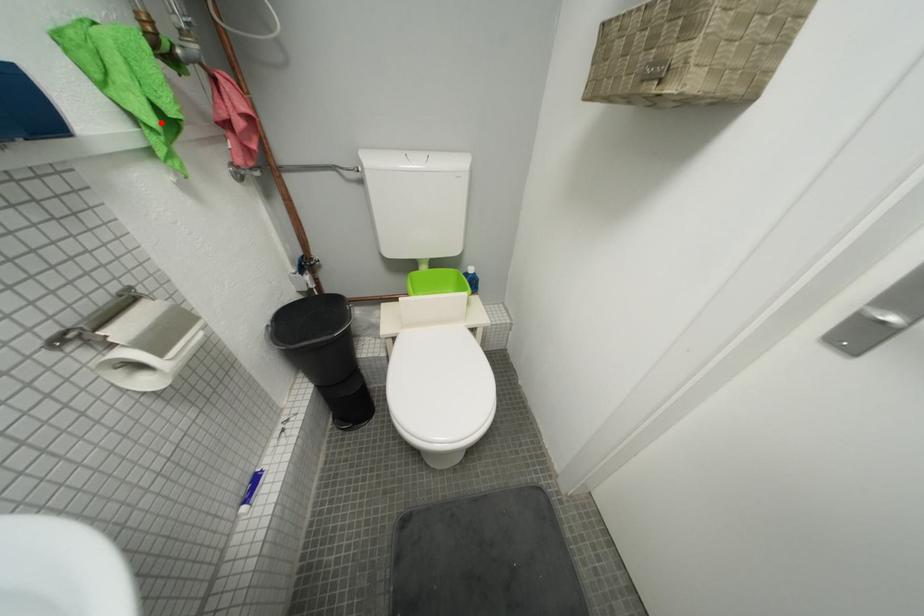
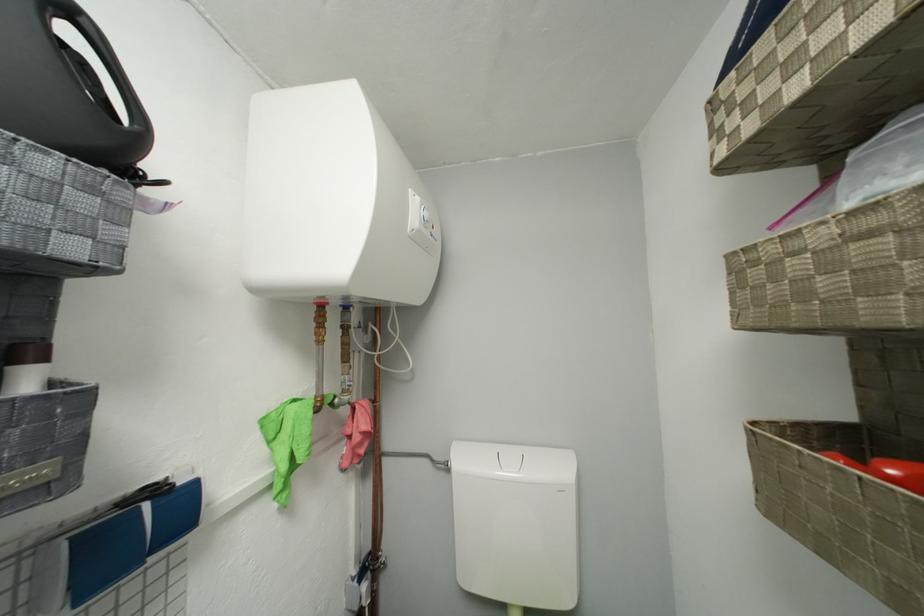
Locate, in the second image, the point that corresponds to the highlighted location in the first image.

(293, 469)